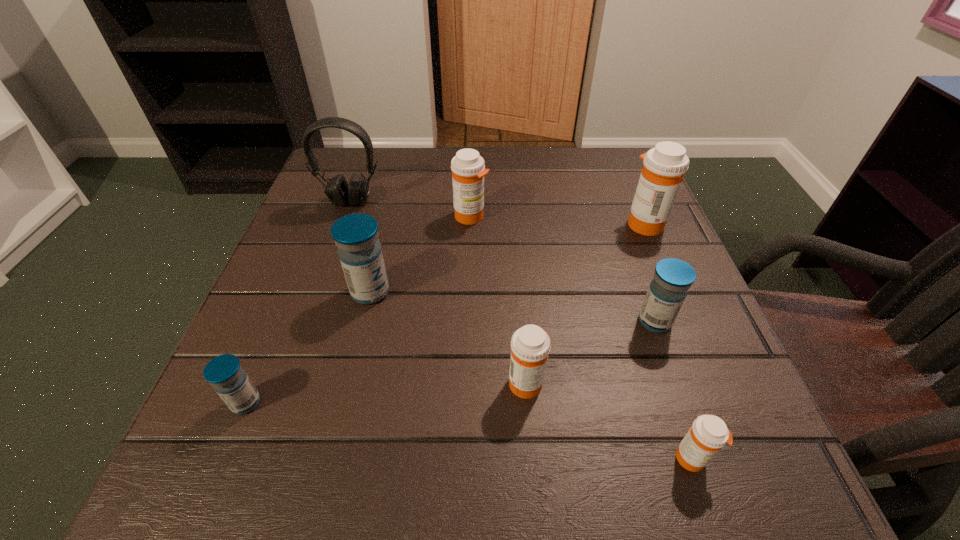
The image size is (960, 540). In the image, there is a desktop. Identify the location of vacant space at the left edge. (330, 351).

The image size is (960, 540). Identify the location of free space at the right edge of the desktop. (651, 420).

Where is `vacant space that is in between the smallest orange medicine and the leftmost blue medicine`? Image resolution: width=960 pixels, height=540 pixels. vacant space that is in between the smallest orange medicine and the leftmost blue medicine is located at coordinates (469, 430).

Where is `empty location between the second biggest blue medicine and the headset`? empty location between the second biggest blue medicine and the headset is located at coordinates (503, 261).

This screenshot has height=540, width=960. Find the location of `free space that is in between the biggest orange medicine and the rightmost blue medicine`. free space that is in between the biggest orange medicine and the rightmost blue medicine is located at coordinates [x=650, y=272].

At what (x,y) coordinates should I click in order to perform the action: click on free area in between the second nearest blue medicine and the nearest orange medicine. Please return your answer as a coordinate pair (x, y). Looking at the image, I should click on (674, 389).

I want to click on vacant region between the leftmost medicine and the rightmost orange medicine, so click(445, 313).

Locate an element on the screen. This screenshot has width=960, height=540. free space between the fourth nearest medicine and the second orange medicine from right to left is located at coordinates (674, 389).

The image size is (960, 540). What are the coordinates of `vacant region between the second farthest blue medicine and the rightmost orange medicine` in the screenshot? It's located at (650, 272).

At what (x,y) coordinates should I click in order to perform the action: click on empty location between the smallest blue medicine and the nearest object. Please return your answer as a coordinate pair (x, y). Image resolution: width=960 pixels, height=540 pixels. Looking at the image, I should click on (469, 430).